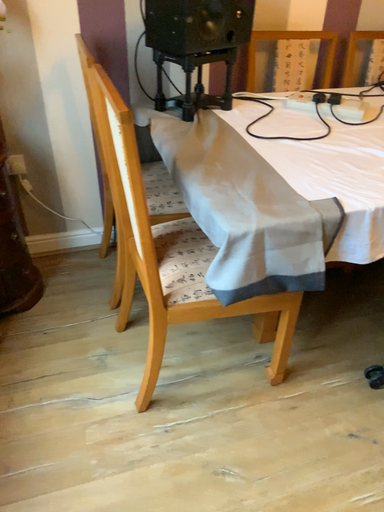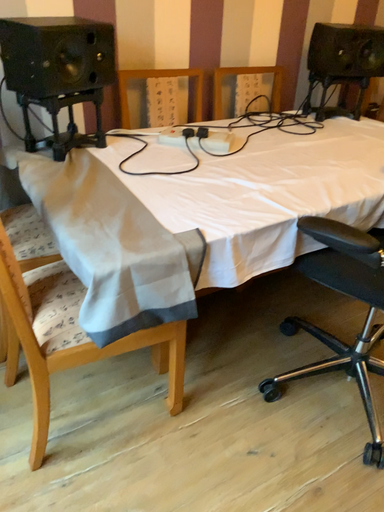
Question: How did the camera likely rotate when shooting the video?

Choices:
 (A) rotated right
 (B) rotated left

Answer: (A)